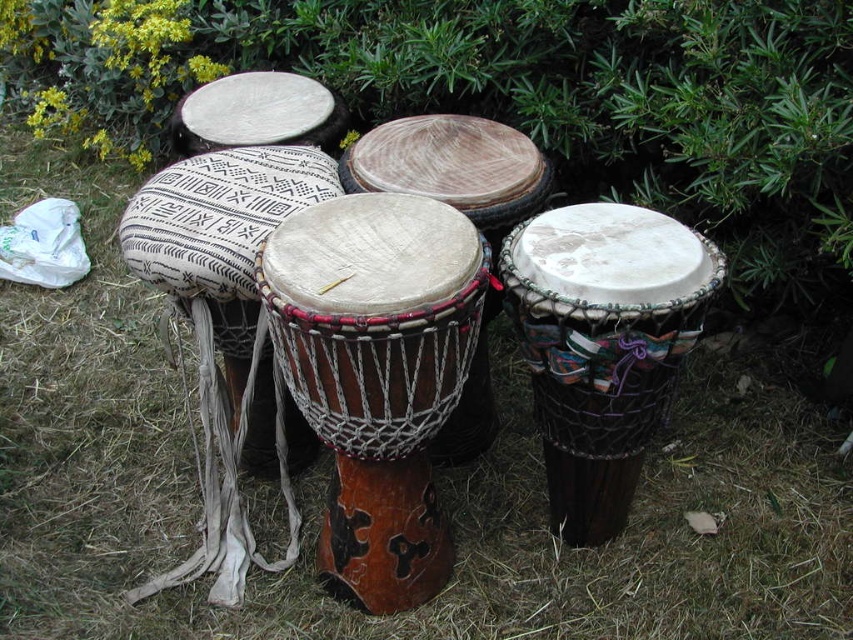
Looking at this image, is natural wood drum at center shorter than white fabric-covered drum at center-left?

Indeed, natural wood drum at center has a lesser height compared to white fabric-covered drum at center-left.

Identify the location of natural wood drum at center. The image size is (853, 640). (602, 344).

Which is in front, point (672, 292) or point (178, 204)?

Positioned in front is point (672, 292).

Image resolution: width=853 pixels, height=640 pixels. Identify the location of natural wood drum at center. (602, 344).

Describe the element at coordinates (376, 374) in the screenshot. I see `brown wooden drum at center` at that location.

Locate an element on the screen. The image size is (853, 640). brown wooden drum at center is located at coordinates (376, 374).

Can you confirm if white fabric-covered drum at center-left is taller than white fabric drum at upper center?

Indeed, white fabric-covered drum at center-left has a greater height compared to white fabric drum at upper center.

Who is higher up, white fabric-covered drum at center-left or white fabric drum at upper center?

white fabric drum at upper center is above.

Is point (242, 276) positioned before point (254, 136)?

Yes, it is.

The image size is (853, 640). I want to click on white fabric-covered drum at center-left, so click(219, 234).